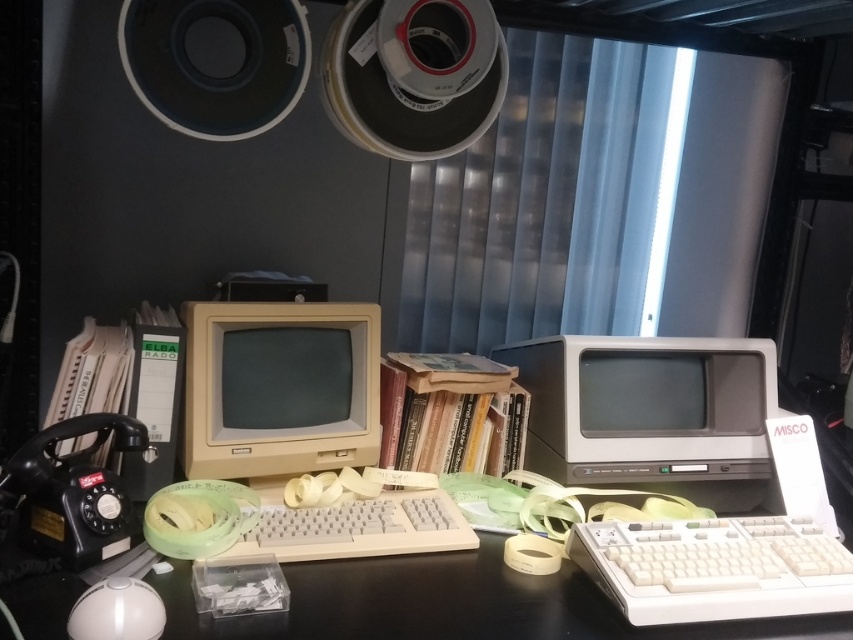
Question: Can you confirm if white plastic computer desk at center is positioned above matte gray monitor at center?

Choices:
 (A) no
 (B) yes

Answer: (A)

Question: Which point is closer to the camera taking this photo?

Choices:
 (A) (521, 566)
 (B) (370, 509)

Answer: (A)

Question: Which point is farther to the camera?

Choices:
 (A) beige plastic monitor at center-left
 (B) white plastic computer desk at center
 (C) matte gray monitor at center

Answer: (C)

Question: Is beige plastic monitor at center-left behind white glossy mouse at lower left?

Choices:
 (A) yes
 (B) no

Answer: (A)

Question: Which of the following is the farthest from the observer?

Choices:
 (A) beige plastic monitor at center-left
 (B) white plastic keyboard at center
 (C) white glossy mouse at lower left

Answer: (A)

Question: Can you confirm if white plastic keyboard at center is positioned above white glossy mouse at lower left?

Choices:
 (A) no
 (B) yes

Answer: (B)